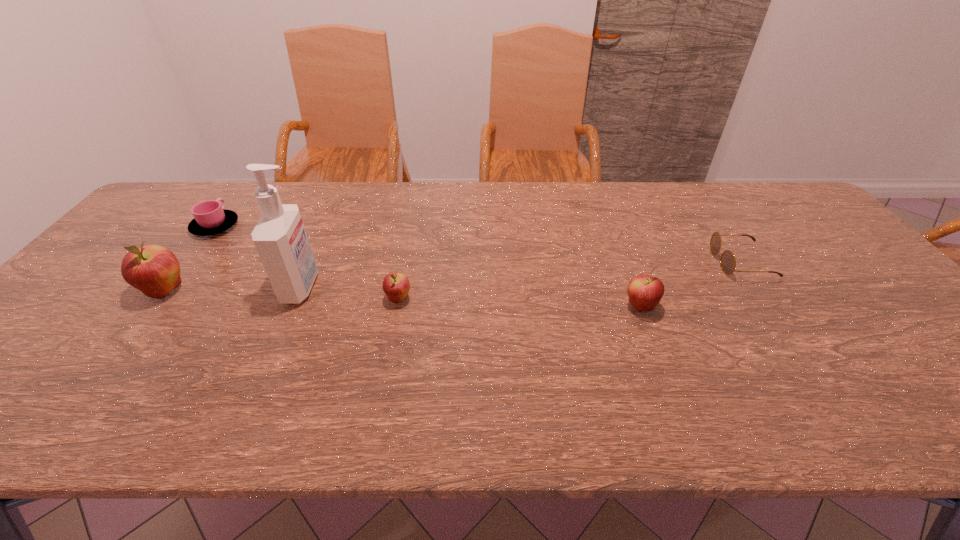
At what (x,y) coordinates should I click in order to perform the action: click on vacant space located on the back of the tallest apple. Please return your answer as a coordinate pair (x, y). The height and width of the screenshot is (540, 960). Looking at the image, I should click on (226, 212).

Where is `vacant point located on the right of the fourth tallest object`? The image size is (960, 540). vacant point located on the right of the fourth tallest object is located at coordinates (502, 299).

Identify the location of vacant space located 0.100m on the front of the rightmost apple. (658, 353).

You are a GUI agent. You are given a task and a screenshot of the screen. Output one action in this format:
    pyautogui.click(x=<x>, y=<y>)
    Task: Click on the vacant area situated 0.290m on the lenses of the sunglasses
    
    Given the screenshot: What is the action you would take?
    pyautogui.click(x=611, y=262)

At what (x,y) coordinates should I click in order to perform the action: click on free region located on the lenses of the sunglasses. Please return your answer as a coordinate pair (x, y). This screenshot has height=540, width=960. Looking at the image, I should click on (661, 262).

What are the coordinates of `vacant area located on the lenses of the sunglasses` in the screenshot? It's located at click(x=643, y=262).

The height and width of the screenshot is (540, 960). I want to click on vacant region located on the front label of the tallest object, so click(379, 287).

The image size is (960, 540). I want to click on free space located on the side with the handle of the farthest object, so click(x=233, y=204).

Find the location of a particular element. free region located 0.140m on the side with the handle of the farthest object is located at coordinates [243, 191].

Where is `vacant space located 0.180m on the side with the handle of the farthest object`? Image resolution: width=960 pixels, height=540 pixels. vacant space located 0.180m on the side with the handle of the farthest object is located at coordinates (x=247, y=185).